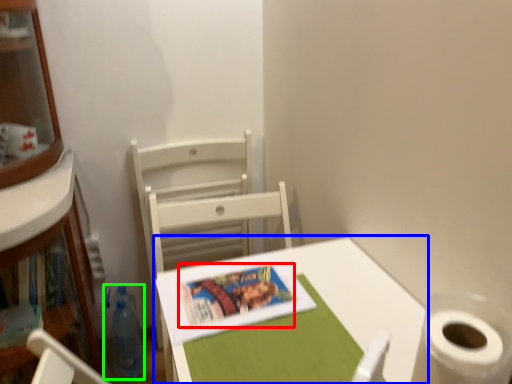
Question: Which object is the closest to the book cover (highlighted by a red box)? Choose among these: table (highlighted by a blue box) or bottle (highlighted by a green box).

Choices:
 (A) table
 (B) bottle

Answer: (A)